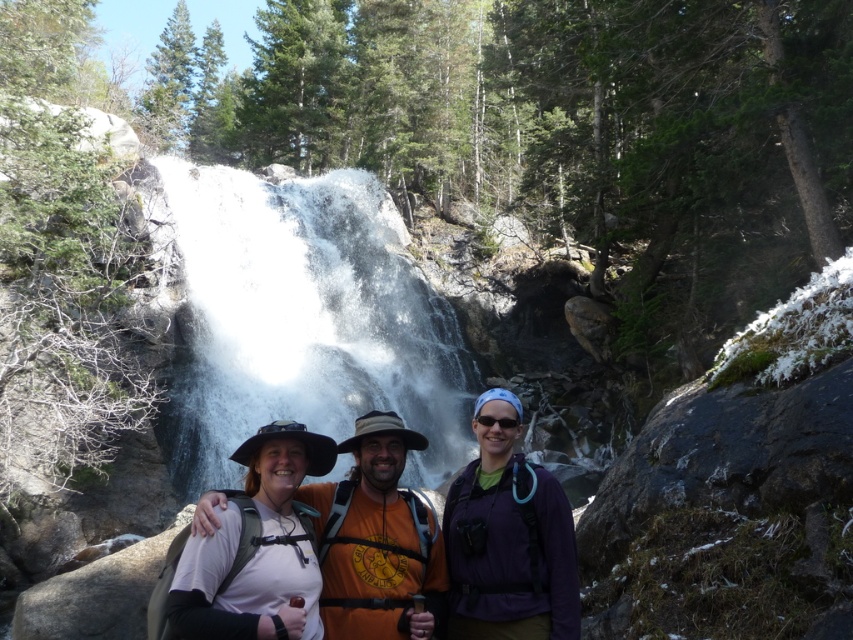
You are a photographer trying to capture a clear shot of the white fabric shirt at center and the purple fabric backpack at center. Which object should you focus on first if you want to ensure both are in focus, considering their sizes?

The white fabric shirt at center has a larger size compared to the purple fabric backpack at center. To ensure both are in focus, you should focus on the white fabric shirt at center first, as larger objects often require more precise focusing to capture details clearly.

You are standing at the point marked as point (390, 528) near the waterfall. Your friend is at the base of the waterfall, which is 30 meters away from you. Can you hear your friend shouting from that distance?

The distance between you and your friend at the base of the waterfall is 30 meters. Since the point (390, 528) is 26.24 meters away from the viewer, the friend is farther away than that point. The maximum distance for shouting to be heard is typically around 20 meters, so it is unlikely you can hear your friend shouting from 30 meters away.

You are a photographer trying to capture the white fabric shirt at center and the white matte hat at center in a clear photo. Since both are white, you want to ensure that the hat doesn not get lost in the background. Based on their positions, which object should you focus on to make sure the hat is visible?

The white matte hat at center is behind the white fabric shirt at center, so focusing on the white fabric shirt at center will keep it in sharp focus while the hat may appear slightly blurred, making it stand out less. Alternatively, focusing on the white matte hat at center would ensure it is clear, but since it is behind, adjusting the composition to have the shirt in front might help differentiate them. However, to specifically ensure the hat is visible, focusing on the white matte hat at center while it